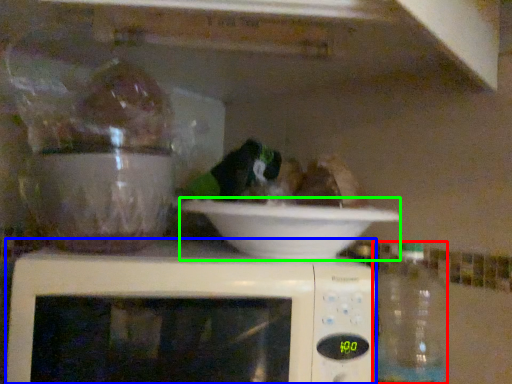
Question: Which is nearer to the bottle (highlighted by a red box)? microwave oven (highlighted by a blue box) or bowl (highlighted by a green box).

Choices:
 (A) microwave oven
 (B) bowl

Answer: (B)